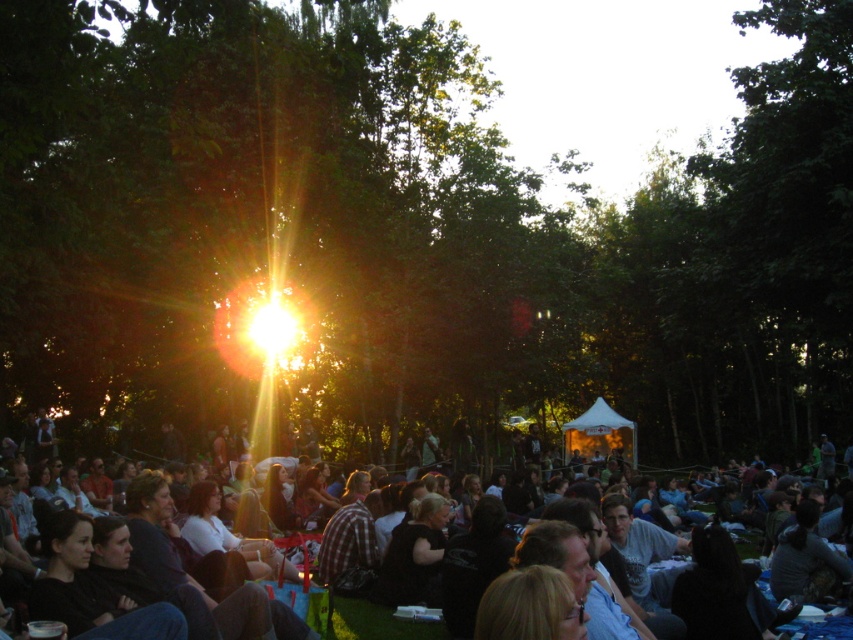
Who is more distant from viewer, (x=770, y=380) or (x=769, y=515)?

Point (x=770, y=380)

Can you confirm if green leafy tree at center is positioned below dark clothing crowd at lower center?

No.

Is point (744, 317) less distant than point (281, 522)?

That is False.

Locate an element on the screen. The width and height of the screenshot is (853, 640). green leafy tree at center is located at coordinates point(403,240).